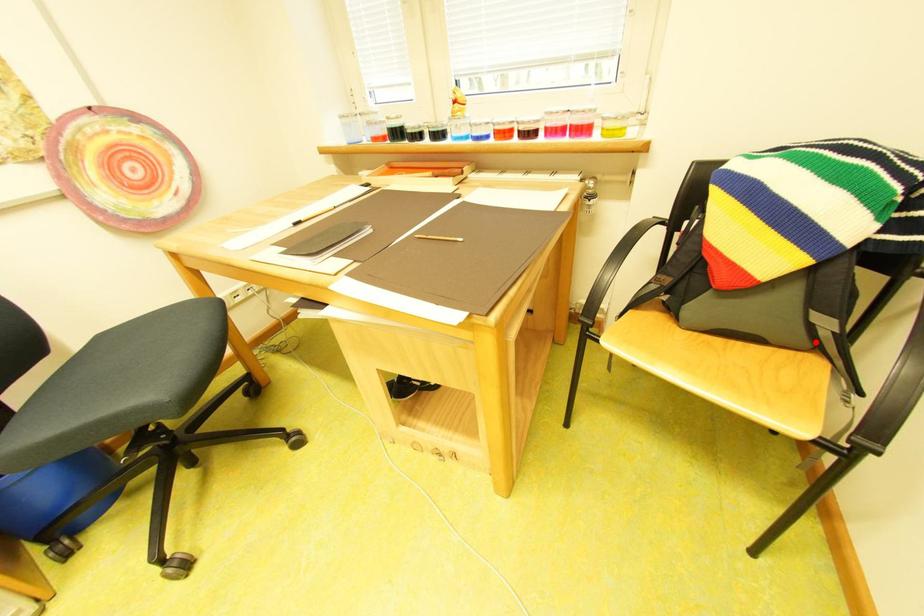
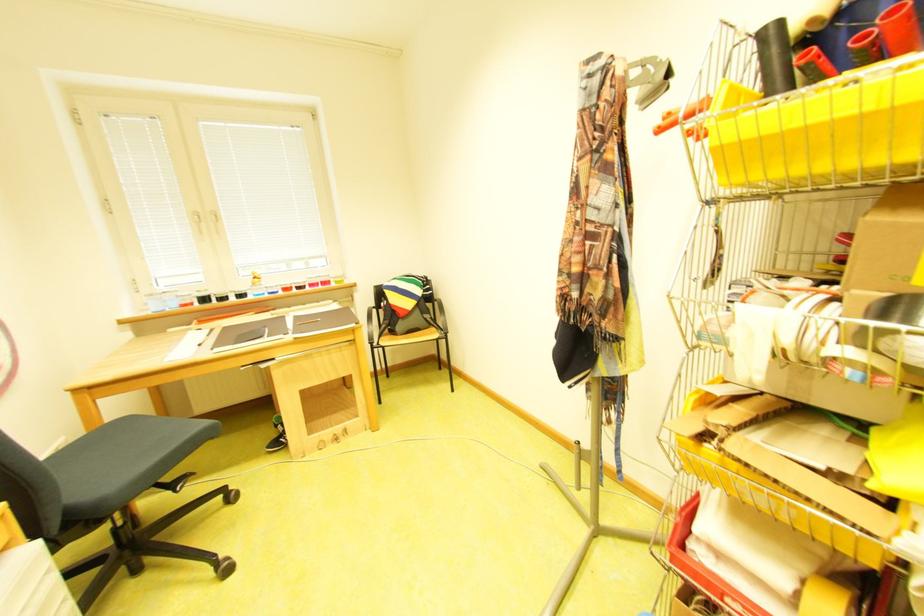
The point at the highlighted location is marked in the first image. Where is the corresponding point in the second image?

(439, 326)